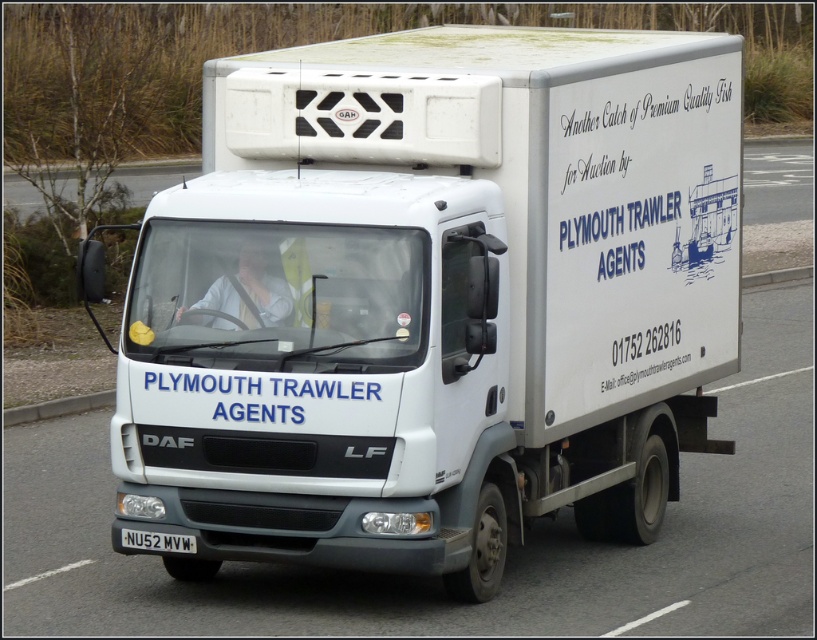
Question: Which of the following is the closest to the observer?

Choices:
 (A) white plastic license plate at lower center
 (B) white matte truck at center

Answer: (B)

Question: Can you confirm if white matte truck at center is positioned above white plastic license plate at lower center?

Choices:
 (A) yes
 (B) no

Answer: (A)

Question: Which point is farther to the camera?

Choices:
 (A) white matte truck at center
 (B) white plastic license plate at lower center

Answer: (B)

Question: Is white matte truck at center to the right of white plastic license plate at lower center from the viewer's perspective?

Choices:
 (A) yes
 (B) no

Answer: (A)

Question: Is white matte truck at center thinner than white plastic license plate at lower center?

Choices:
 (A) no
 (B) yes

Answer: (A)